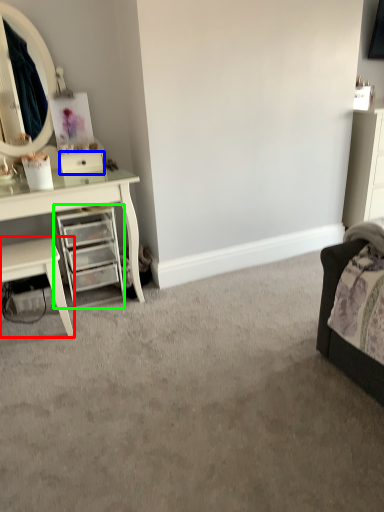
Question: Estimate the real-world distances between objects in this image. Which object is closer to nightstand (highlighted by a red box), drawer (highlighted by a blue box) or chest of drawers (highlighted by a green box)?

Choices:
 (A) drawer
 (B) chest of drawers

Answer: (B)